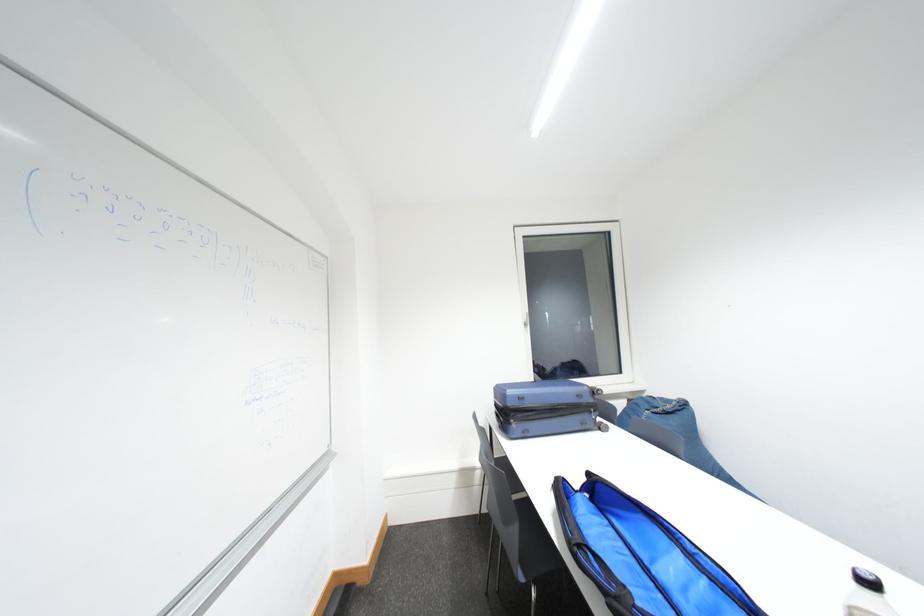
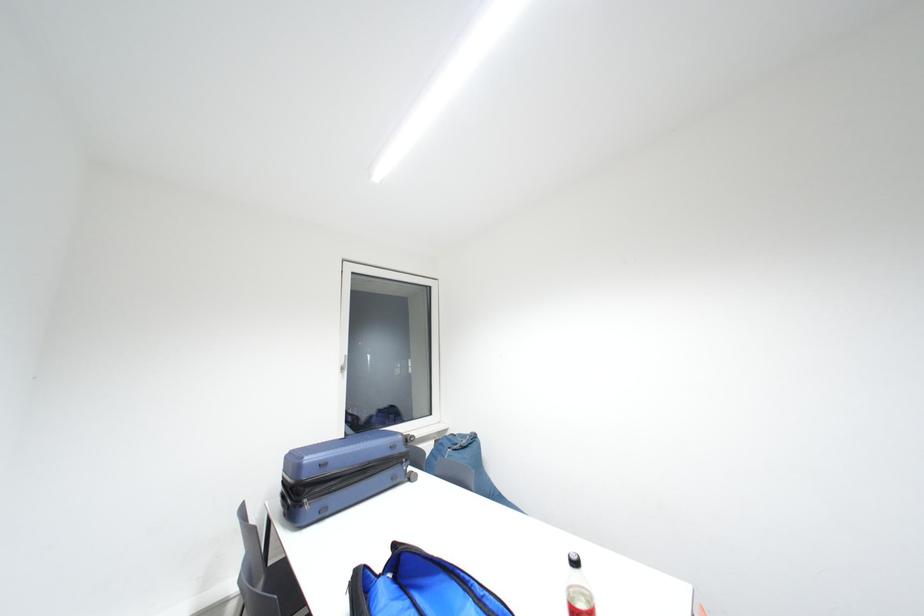
Question: How did the camera likely rotate?

Choices:
 (A) Left
 (B) Right
 (C) Up
 (D) Down

Answer: (B)